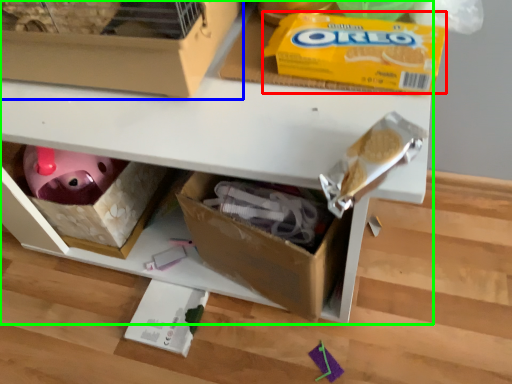
Question: Which object is positioned closest to cereal (highlighted by a red box)? Select from box (highlighted by a blue box) and shelf (highlighted by a green box).

Choices:
 (A) box
 (B) shelf

Answer: (A)